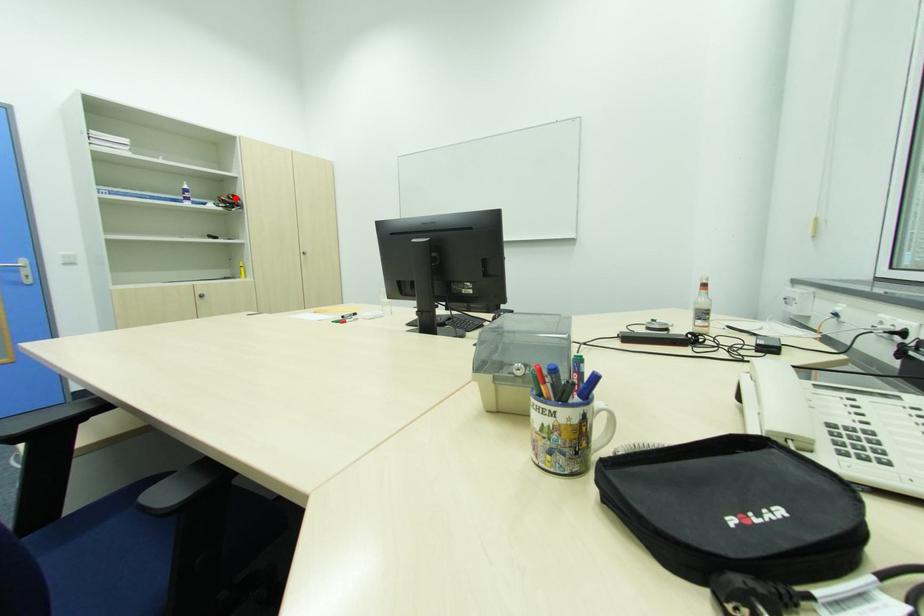
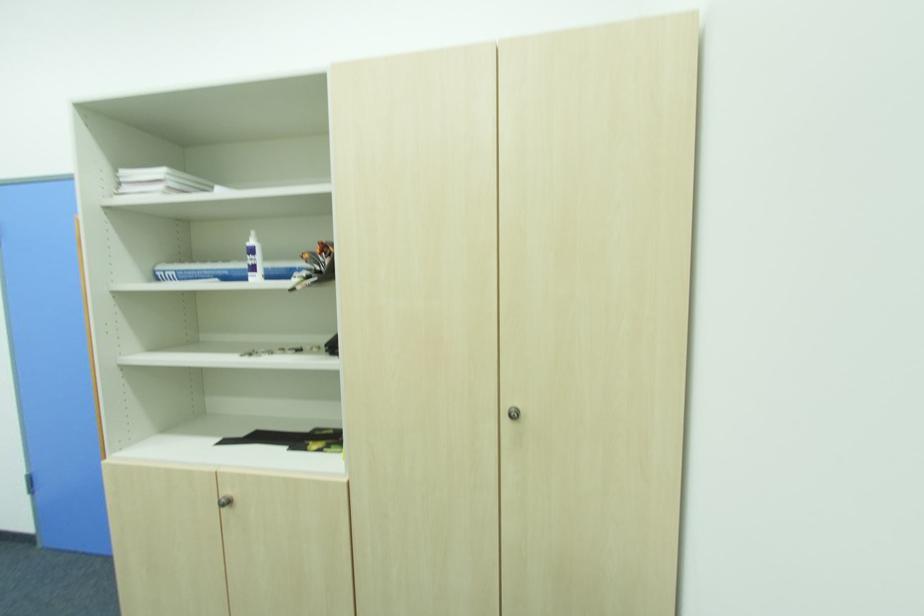
Where in the second image is the point corresponding to the highlighted location from the first image?

(321, 252)